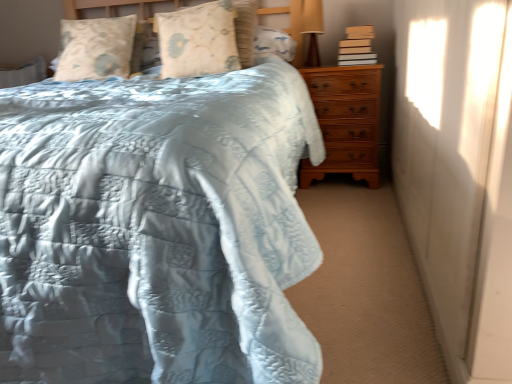
What is the approximate width of light beige fabric pillow at upper left, which ranks as the first pillow in left-to-right order?

light beige fabric pillow at upper left, which ranks as the first pillow in left-to-right order, is 11.74 inches in width.

This screenshot has height=384, width=512. I want to click on light blue quilted bed at center, so click(x=156, y=230).

Describe the element at coordinates (156, 230) in the screenshot. I see `light blue quilted bed at center` at that location.

Measure the distance between brown wooden chest of drawers at right and camera.

brown wooden chest of drawers at right and camera are 7.16 feet apart.

Image resolution: width=512 pixels, height=384 pixels. I want to click on light brown cardboard book at upper right, so click(357, 47).

Find the location of a particular element. The width and height of the screenshot is (512, 384). light beige fabric pillow at upper left, which ranks as the first pillow in left-to-right order is located at coordinates (95, 48).

Is the depth of matte brown table lamp at upper right greater than that of light brown cardboard book at upper right?

That is True.

Considering the sizes of objects matte brown table lamp at upper right and light brown cardboard book at upper right in the image provided, who is wider, matte brown table lamp at upper right or light brown cardboard book at upper right?

With larger width is light brown cardboard book at upper right.

Is matte brown table lamp at upper right taller or shorter than light brown cardboard book at upper right?

In the image, matte brown table lamp at upper right appears to be taller than light brown cardboard book at upper right.

Identify the location of table lamp that is behind the light beige fabric pillow at upper left, which ranks as the first pillow in left-to-right order. Image resolution: width=512 pixels, height=384 pixels. (312, 29).

From a real-world perspective, is light beige fabric pillow at upper left, which ranks as the first pillow in left-to-right order, physically located above or below matte brown table lamp at upper right?

In terms of real-world spatial position, light beige fabric pillow at upper left, which ranks as the first pillow in left-to-right order, is above matte brown table lamp at upper right.

Is point (65, 31) closer or farther from the camera than point (306, 1)?

Point (65, 31) is farther from the camera than point (306, 1).

Which of these two, light beige fabric pillow at upper left, which ranks as the first pillow in left-to-right order, or matte brown table lamp at upper right, stands taller?

Standing taller between the two is matte brown table lamp at upper right.

Does light beige fabric pillow at upper left, which ranks as the first pillow in left-to-right order, turn towards light brown cardboard book at upper right?

No, light beige fabric pillow at upper left, which ranks as the first pillow in left-to-right order, is not oriented towards light brown cardboard book at upper right.

Image resolution: width=512 pixels, height=384 pixels. What are the coordinates of `book lying below the light beige fabric pillow at upper left, which is counted as the second pillow, starting from the right (from the image's perspective)` in the screenshot? It's located at (357, 47).

Is point (70, 50) closer or farther from the camera than point (371, 34)?

Point (70, 50) is closer to the camera than point (371, 34).

Considering the relative sizes of light beige fabric pillow at upper left, which ranks as the first pillow in left-to-right order, and light brown cardboard book at upper right in the image provided, is light beige fabric pillow at upper left, which ranks as the first pillow in left-to-right order, wider than light brown cardboard book at upper right?

Indeed, light beige fabric pillow at upper left, which ranks as the first pillow in left-to-right order, has a greater width compared to light brown cardboard book at upper right.

Considering the sizes of white matte curtain at right and light beige fabric pillow at upper left, which ranks as the first pillow in left-to-right order, in the image, is white matte curtain at right taller or shorter than light beige fabric pillow at upper left, which ranks as the first pillow in left-to-right order,?

Considering their sizes, white matte curtain at right has more height than light beige fabric pillow at upper left, which ranks as the first pillow in left-to-right order.

Does point (406, 141) come in front of point (74, 39)?

Yes, it is.

Who is bigger, white matte curtain at right or light beige fabric pillow at upper left, which is counted as the second pillow, starting from the right?

With larger size is white matte curtain at right.

In the scene shown: From a real-world perspective, which is physically above, white matte curtain at right or light beige fabric pillow at upper left, which is counted as the second pillow, starting from the right?

From a 3D spatial view, light beige fabric pillow at upper left, which is counted as the second pillow, starting from the right, is above.

Which is behind, brown wooden chest of drawers at right or floral-patterned fabric pillow at upper center, positioned as the first pillow in right-to-left order?

Positioned behind is brown wooden chest of drawers at right.

From the image's perspective, does brown wooden chest of drawers at right appear lower than floral-patterned fabric pillow at upper center, the 2th pillow positioned from the left?

Yes, from the image's perspective, brown wooden chest of drawers at right is beneath floral-patterned fabric pillow at upper center, the 2th pillow positioned from the left.

How far apart are brown wooden chest of drawers at right and floral-patterned fabric pillow at upper center, the 2th pillow positioned from the left?

A distance of 61.91 centimeters exists between brown wooden chest of drawers at right and floral-patterned fabric pillow at upper center, the 2th pillow positioned from the left.

Which object is wider, brown wooden chest of drawers at right or floral-patterned fabric pillow at upper center, the 2th pillow positioned from the left?

With larger width is brown wooden chest of drawers at right.

Does floral-patterned fabric pillow at upper center, positioned as the first pillow in right-to-left order, have a smaller size compared to light blue quilted bed at center?

Yes, floral-patterned fabric pillow at upper center, positioned as the first pillow in right-to-left order, is smaller than light blue quilted bed at center.

Is floral-patterned fabric pillow at upper center, the 2th pillow positioned from the left, inside or outside of light blue quilted bed at center?

floral-patterned fabric pillow at upper center, the 2th pillow positioned from the left, is enclosed within light blue quilted bed at center.

In the image, is floral-patterned fabric pillow at upper center, positioned as the first pillow in right-to-left order, on the left side or the right side of light blue quilted bed at center?

Clearly, floral-patterned fabric pillow at upper center, positioned as the first pillow in right-to-left order, is on the right of light blue quilted bed at center in the image.

From a real-world perspective, which object rests below the other?

light blue quilted bed at center.

Does point (354, 120) lie behind point (366, 62)?

Yes, it is behind point (366, 62).

Are brown wooden chest of drawers at right and light brown cardboard book at upper right making contact?

brown wooden chest of drawers at right is not next to light brown cardboard book at upper right, and they're not touching.

From the image's perspective, is brown wooden chest of drawers at right located above light brown cardboard book at upper right?

Actually, brown wooden chest of drawers at right appears below light brown cardboard book at upper right in the image.

Considering the relative positions of brown wooden chest of drawers at right and light brown cardboard book at upper right in the image provided, is brown wooden chest of drawers at right to the left of light brown cardboard book at upper right from the viewer's perspective?

Yes.

The image size is (512, 384). I want to click on table lamp above the light brown cardboard book at upper right (from a real-world perspective), so click(x=312, y=29).

Locate an element on the screen. table lamp lying on the right of light beige fabric pillow at upper left, which ranks as the first pillow in left-to-right order is located at coordinates (312, 29).

When comparing their distances from matte brown table lamp at upper right, does floral-patterned fabric pillow at upper center, the 2th pillow positioned from the left, or brown wooden chest of drawers at right seem closer?

brown wooden chest of drawers at right.

Based on their spatial positions, is matte brown table lamp at upper right or brown wooden chest of drawers at right further from light beige fabric pillow at upper left, which ranks as the first pillow in left-to-right order?

brown wooden chest of drawers at right.

Which object lies further to the anchor point floral-patterned fabric pillow at upper center, the 2th pillow positioned from the left, light blue quilted bed at center or brown wooden chest of drawers at right?

The object further to floral-patterned fabric pillow at upper center, the 2th pillow positioned from the left, is light blue quilted bed at center.

Looking at the image, which one is located further to light brown cardboard book at upper right, light beige fabric pillow at upper left, which is counted as the second pillow, starting from the right, or floral-patterned fabric pillow at upper center, the 2th pillow positioned from the left?

light beige fabric pillow at upper left, which is counted as the second pillow, starting from the right.

Based on their spatial positions, is white matte curtain at right or light beige fabric pillow at upper left, which is counted as the second pillow, starting from the right, closer to light brown cardboard book at upper right?

Based on the image, white matte curtain at right appears to be nearer to light brown cardboard book at upper right.

Considering their positions, is matte brown table lamp at upper right positioned further to white matte curtain at right than brown wooden chest of drawers at right?

matte brown table lamp at upper right is positioned further to the anchor white matte curtain at right.

Considering their positions, is brown wooden chest of drawers at right positioned closer to matte brown table lamp at upper right than light beige fabric pillow at upper left, which is counted as the second pillow, starting from the right?

brown wooden chest of drawers at right is positioned closer to the anchor matte brown table lamp at upper right.

Which object lies further to the anchor point matte brown table lamp at upper right, light beige fabric pillow at upper left, which is counted as the second pillow, starting from the right, or brown wooden chest of drawers at right?

Among the two, light beige fabric pillow at upper left, which is counted as the second pillow, starting from the right, is located further to matte brown table lamp at upper right.

The width and height of the screenshot is (512, 384). Identify the location of curtain between light blue quilted bed at center and matte brown table lamp at upper right from front to back. (459, 173).

The height and width of the screenshot is (384, 512). Identify the location of table lamp located between light beige fabric pillow at upper left, which is counted as the second pillow, starting from the right, and light brown cardboard book at upper right in the left-right direction. (312, 29).

At what (x,y) coordinates should I click in order to perform the action: click on chest of drawers between light blue quilted bed at center and matte brown table lamp at upper right along the z-axis. Please return your answer as a coordinate pair (x, y). The height and width of the screenshot is (384, 512). Looking at the image, I should click on (345, 121).

Where is `curtain located between light blue quilted bed at center and brown wooden chest of drawers at right in the depth direction`? The image size is (512, 384). curtain located between light blue quilted bed at center and brown wooden chest of drawers at right in the depth direction is located at coordinates (459, 173).